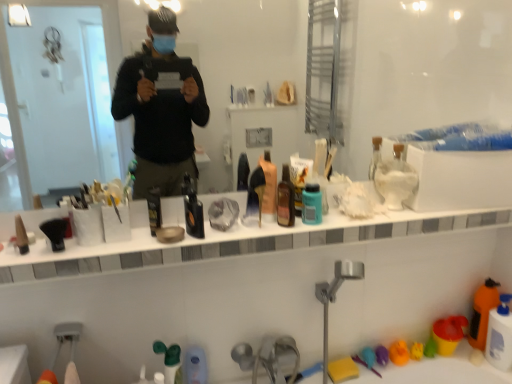
Question: Which direction should I rotate to look at black matte bottle at center, which ranks as the third mouthwash in right-to-left order?

Choices:
 (A) right
 (B) left

Answer: (B)

Question: Is white glossy counter top at center not inside green matte toothpaste at lower center, the 3th toiletry in the top-to-bottom sequence?

Choices:
 (A) yes
 (B) no

Answer: (A)

Question: Is white glossy counter top at center to the left of green matte toothpaste at lower center, the 2th toiletry when ordered from right to left, from the viewer's perspective?

Choices:
 (A) yes
 (B) no

Answer: (B)

Question: Considering the relative sizes of white glossy counter top at center and green matte toothpaste at lower center, the 2th toiletry when ordered from right to left, in the image provided, is white glossy counter top at center taller than green matte toothpaste at lower center, the 2th toiletry when ordered from right to left,?

Choices:
 (A) no
 (B) yes

Answer: (A)

Question: Does white glossy counter top at center have a greater width compared to green matte toothpaste at lower center, the 2th toiletry when ordered from right to left?

Choices:
 (A) yes
 (B) no

Answer: (A)

Question: Is white glossy counter top at center smaller than green matte toothpaste at lower center, the 2th toiletry when ordered from right to left?

Choices:
 (A) no
 (B) yes

Answer: (A)

Question: From a real-world perspective, is white glossy counter top at center over green matte toothpaste at lower center, the second toiletry in the bottom-to-top sequence?

Choices:
 (A) yes
 (B) no

Answer: (A)

Question: Is black matte hairbrush at left, positioned as the 1th toiletry in front-to-back order, to the left of yellow sponge at lower center, the 1th toy positioned from the left, from the viewer's perspective?

Choices:
 (A) no
 (B) yes

Answer: (B)

Question: Is black matte hairbrush at left, the fourth toiletry positioned from the back, taller than yellow sponge at lower center, the 1th toy positioned from the left?

Choices:
 (A) yes
 (B) no

Answer: (A)

Question: Does black matte hairbrush at left, positioned as the 1th toiletry in front-to-back order, have a greater width compared to yellow sponge at lower center, the 3th toy when ordered from right to left?

Choices:
 (A) yes
 (B) no

Answer: (B)

Question: From the image's perspective, is black matte hairbrush at left, the fourth toiletry positioned from the back, located beneath yellow sponge at lower center, the 3th toy when ordered from right to left?

Choices:
 (A) no
 (B) yes

Answer: (A)

Question: Does black matte hairbrush at left, positioned as the 1th toiletry in front-to-back order, have a larger size compared to yellow sponge at lower center, the 1th toy positioned from the left?

Choices:
 (A) no
 (B) yes

Answer: (A)

Question: Considering the relative sizes of black matte hairbrush at left, acting as the 2th toiletry starting from the top, and yellow sponge at lower center, the 1th toy positioned from the left, in the image provided, is black matte hairbrush at left, acting as the 2th toiletry starting from the top, thinner than yellow sponge at lower center, the 1th toy positioned from the left,?

Choices:
 (A) no
 (B) yes

Answer: (B)

Question: Considering the relative positions of white matte bottle at upper center, arranged as the first cleaning product when viewed from the left, and transparent glass mirror at upper center in the image provided, is white matte bottle at upper center, arranged as the first cleaning product when viewed from the left, to the right of transparent glass mirror at upper center from the viewer's perspective?

Choices:
 (A) yes
 (B) no

Answer: (A)